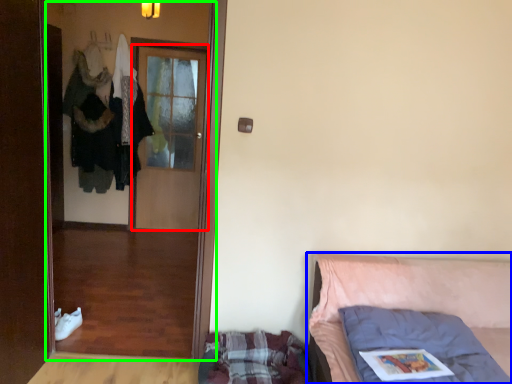
Question: Which is nearer to the door (highlighted by a red box)? furniture (highlighted by a blue box) or screen door (highlighted by a green box).

Choices:
 (A) furniture
 (B) screen door

Answer: (B)